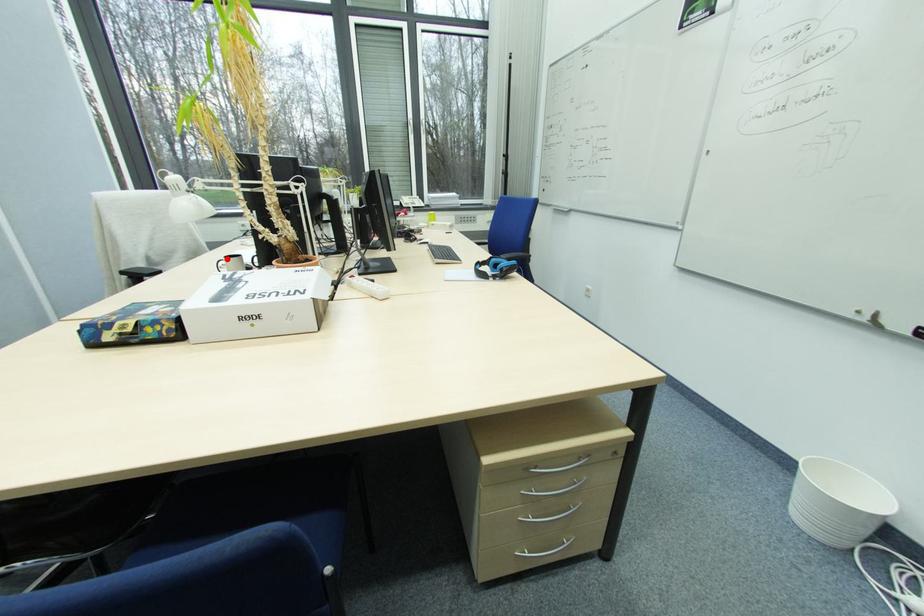
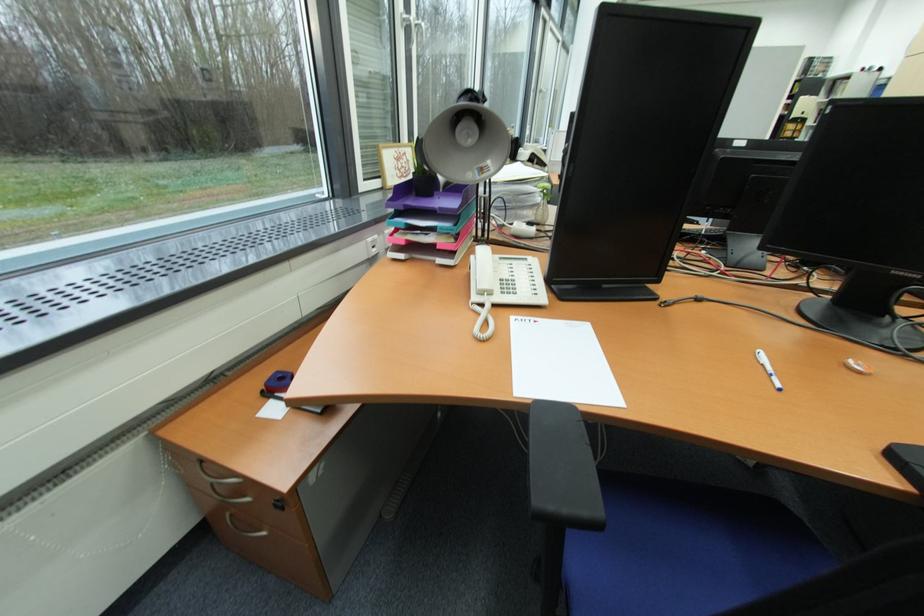
Question: I am providing you with two images of the same scene from different viewpoints. A red point is marked on the first image. At the location where the point appears in image 1, is it still visible in image 2?

Choices:
 (A) Yes
 (B) No

Answer: (B)